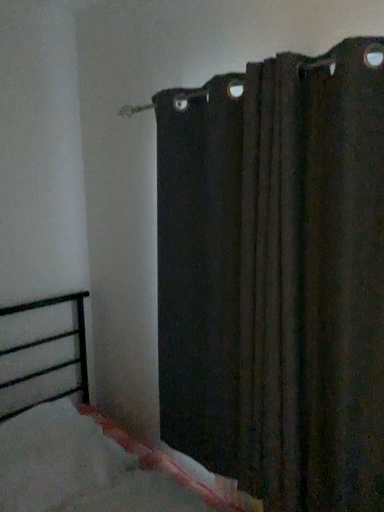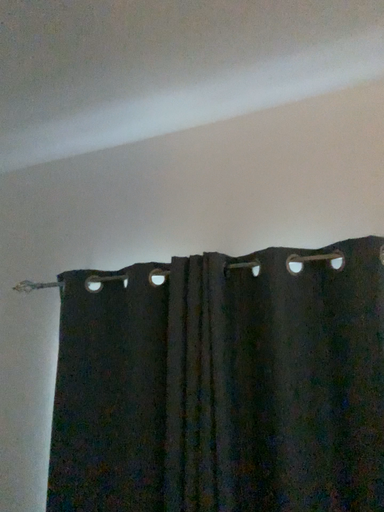
Question: How did the camera likely rotate when shooting the video?

Choices:
 (A) rotated downward
 (B) rotated upward

Answer: (B)